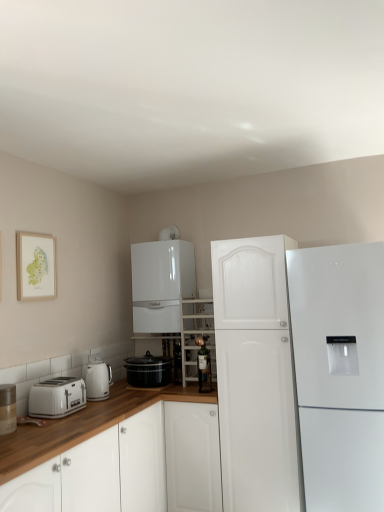
Locate an element on the screen. The height and width of the screenshot is (512, 384). free space to the back side of matte glass bottle at center is located at coordinates (197, 389).